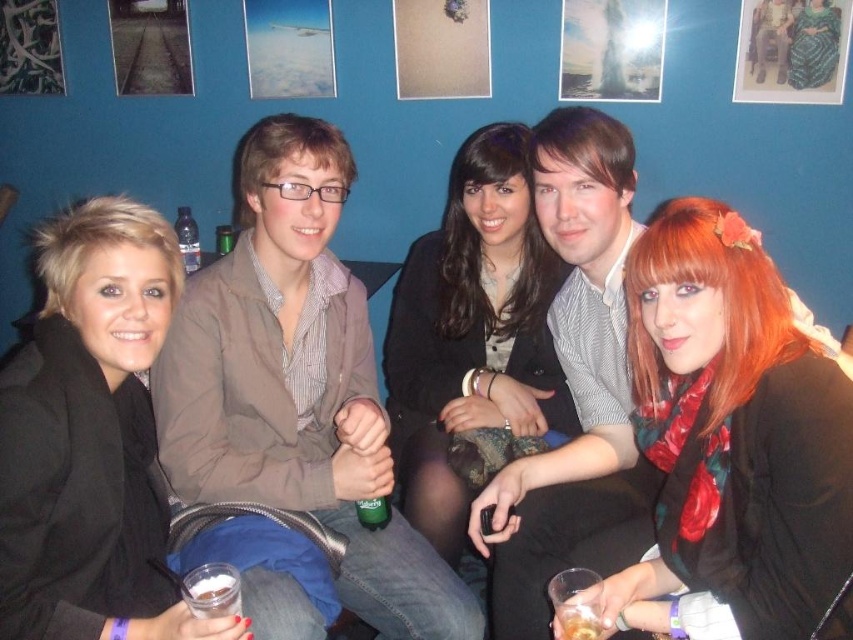
Who is higher up, dark brown textured coat at center or translucent plastic cup at lower left?

dark brown textured coat at center is above.

Can you confirm if dark brown textured coat at center is taller than translucent plastic cup at lower left?

Correct, dark brown textured coat at center is much taller as translucent plastic cup at lower left.

What do you see at coordinates (473, 332) in the screenshot?
I see `dark brown textured coat at center` at bounding box center [473, 332].

Find the location of a particular element. The height and width of the screenshot is (640, 853). dark brown textured coat at center is located at coordinates (473, 332).

Can you confirm if brown cotton jacket at center is bigger than translucent plastic cup at lower left?

Correct, brown cotton jacket at center is larger in size than translucent plastic cup at lower left.

Is brown cotton jacket at center positioned before translucent plastic cup at lower left?

No.

Which is behind, point (252, 157) or point (204, 612)?

Point (252, 157)

Find the location of a particular element. This screenshot has height=640, width=853. brown cotton jacket at center is located at coordinates (296, 384).

The image size is (853, 640). What do you see at coordinates (90, 438) in the screenshot? I see `black matte jacket at left` at bounding box center [90, 438].

Between black matte jacket at left and green matte can at center, which one has more height?

black matte jacket at left is taller.

This screenshot has width=853, height=640. I want to click on black matte jacket at left, so click(90, 438).